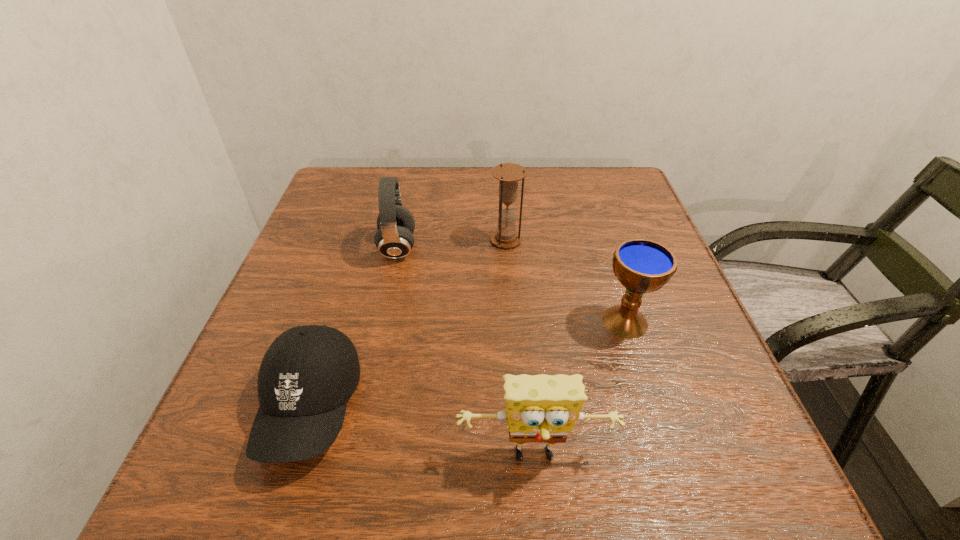
At what (x,y) coordinates should I click in order to perform the action: click on baseball cap that is at the near edge. Please return your answer as a coordinate pair (x, y). Image resolution: width=960 pixels, height=540 pixels. Looking at the image, I should click on (307, 375).

I want to click on object that is at the left edge, so click(307, 375).

Find the location of a particular element. Image resolution: width=960 pixels, height=540 pixels. object that is positioned at the right edge is located at coordinates (641, 265).

At what (x,y) coordinates should I click in order to perform the action: click on object that is at the near left corner. Please return your answer as a coordinate pair (x, y). Image resolution: width=960 pixels, height=540 pixels. Looking at the image, I should click on (307, 375).

Where is `vacant space at the far edge of the desktop`? vacant space at the far edge of the desktop is located at coordinates (564, 174).

The width and height of the screenshot is (960, 540). What are the coordinates of `vacant area at the near edge` in the screenshot? It's located at (517, 468).

Locate an element on the screen. free location at the left edge of the desktop is located at coordinates (332, 225).

Locate an element on the screen. vacant space at the right edge of the desktop is located at coordinates (672, 410).

I want to click on vacant area at the near left corner, so click(238, 469).

Image resolution: width=960 pixels, height=540 pixels. In the image, there is a desktop. Find the location of `blank space at the far right corner`. blank space at the far right corner is located at coordinates (579, 203).